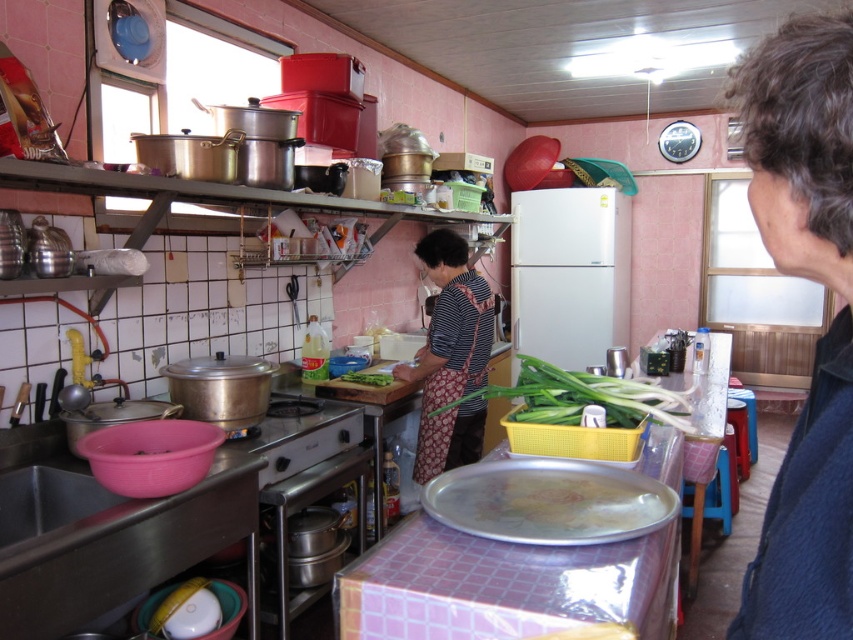
Which is more to the right, metallic silver tray at center or green leafy vegetables at center?

From the viewer's perspective, green leafy vegetables at center appears more on the right side.

Can you confirm if metallic silver tray at center is wider than green leafy vegetables at center?

No.

Locate an element on the screen. The height and width of the screenshot is (640, 853). metallic silver tray at center is located at coordinates (549, 500).

Looking at this image, is green leafy vegetables at center to the left of green leafy vegetable at center from the viewer's perspective?

No, green leafy vegetables at center is not to the left of green leafy vegetable at center.

Based on the photo, can you confirm if green leafy vegetables at center is taller than green leafy vegetable at center?

Correct, green leafy vegetables at center is much taller as green leafy vegetable at center.

Is point (677, 422) closer to camera compared to point (360, 371)?

Yes.

You are a GUI agent. You are given a task and a screenshot of the screen. Output one action in this format:
    pyautogui.click(x=<x>, y=<y>)
    Task: Click on the green leafy vegetables at center
    
    Given the screenshot: What is the action you would take?
    pyautogui.click(x=582, y=397)

Describe the element at coordinates (549, 500) in the screenshot. I see `metallic silver tray at center` at that location.

Does metallic silver tray at center have a lesser width compared to striped fabric apron at center?

Yes, metallic silver tray at center is thinner than striped fabric apron at center.

At what (x,y) coordinates should I click in order to perform the action: click on metallic silver tray at center. Please return your answer as a coordinate pair (x, y). This screenshot has width=853, height=640. Looking at the image, I should click on (549, 500).

Find the location of a particular element. This screenshot has height=640, width=853. metallic silver tray at center is located at coordinates click(x=549, y=500).